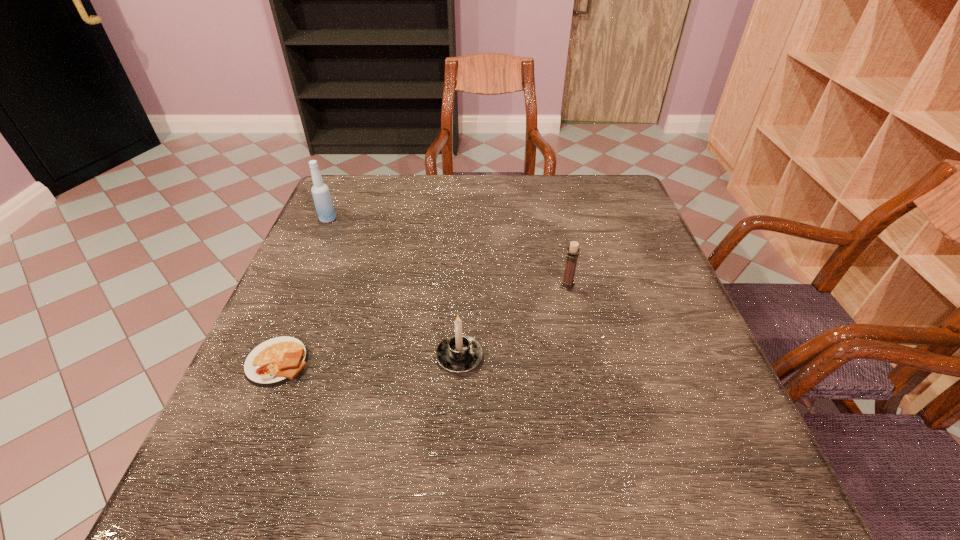
Where is `vacant space positioned 0.190m with a handle on the side of the nearer candle holder`? The height and width of the screenshot is (540, 960). vacant space positioned 0.190m with a handle on the side of the nearer candle holder is located at coordinates (463, 275).

I want to click on vacant space located 0.290m with a handle on the side of the nearer candle holder, so click(465, 248).

Identify the location of free space located on the right of the omelet. (431, 362).

Locate an element on the screen. object that is at the far edge is located at coordinates (324, 206).

This screenshot has width=960, height=540. In order to click on bottle at the left edge in this screenshot , I will do `click(324, 206)`.

Image resolution: width=960 pixels, height=540 pixels. Identify the location of omelet positioned at the left edge. (275, 361).

The image size is (960, 540). I want to click on object that is at the far left corner, so click(324, 206).

At what (x,y) coordinates should I click in order to perform the action: click on free space at the far edge. Please return your answer as a coordinate pair (x, y). The width and height of the screenshot is (960, 540). Looking at the image, I should click on (500, 186).

At what (x,y) coordinates should I click in order to perform the action: click on vacant space at the near edge of the desktop. Please return your answer as a coordinate pair (x, y). The height and width of the screenshot is (540, 960). Looking at the image, I should click on (570, 467).

You are a GUI agent. You are given a task and a screenshot of the screen. Output one action in this format:
    pyautogui.click(x=<x>, y=<y>)
    Task: Click on the vacant space at the left edge of the desktop
    The image size is (960, 540).
    Given the screenshot: What is the action you would take?
    pyautogui.click(x=309, y=246)